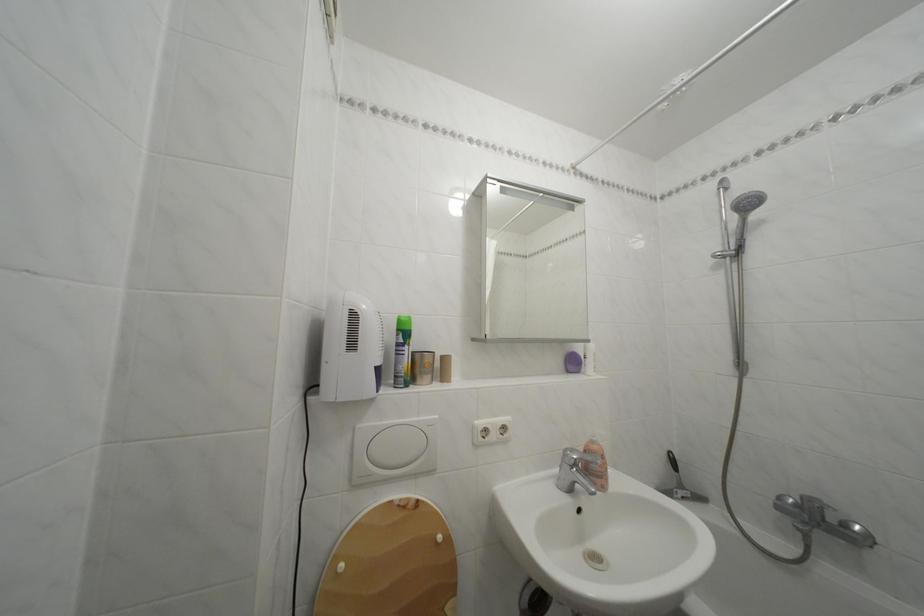
Image resolution: width=924 pixels, height=616 pixels. I want to click on faucet handle, so click(x=594, y=484).